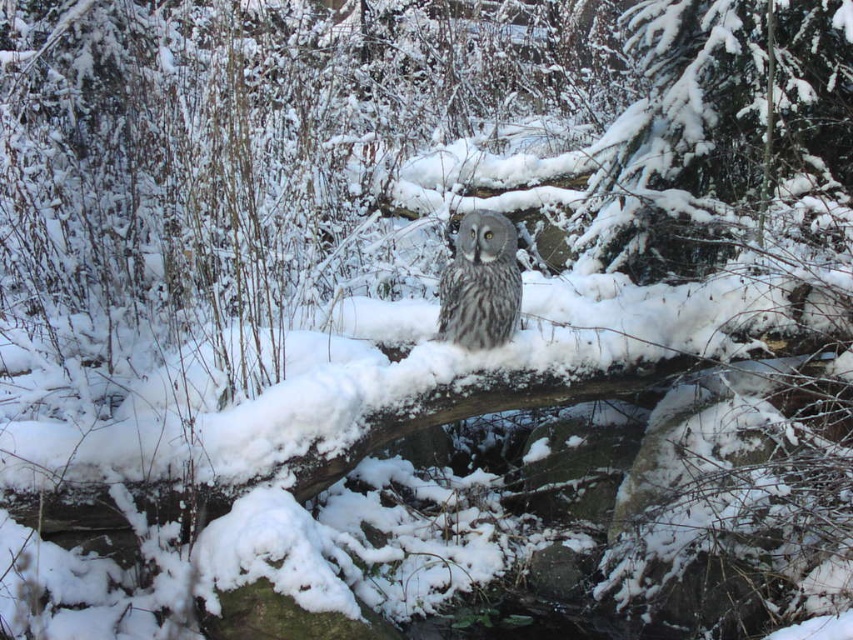
Can you confirm if snow-covered evergreen tree at center is positioned above gray speckled owl at center?

Yes.

Describe the element at coordinates (720, 124) in the screenshot. The width and height of the screenshot is (853, 640). I see `snow-covered evergreen tree at center` at that location.

What are the coordinates of `snow-covered evergreen tree at center` in the screenshot? It's located at (720, 124).